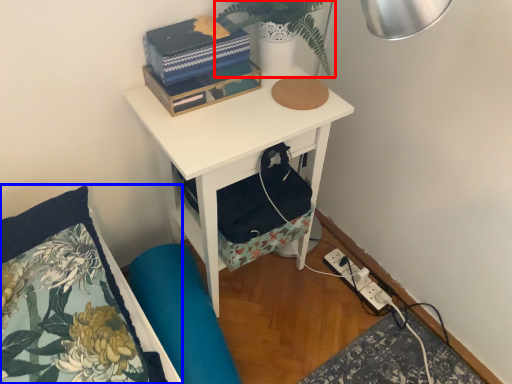
Question: Which of the following is the closest to the observer, plant (highlighted by a red box) or pillow (highlighted by a blue box)?

Choices:
 (A) plant
 (B) pillow

Answer: (B)